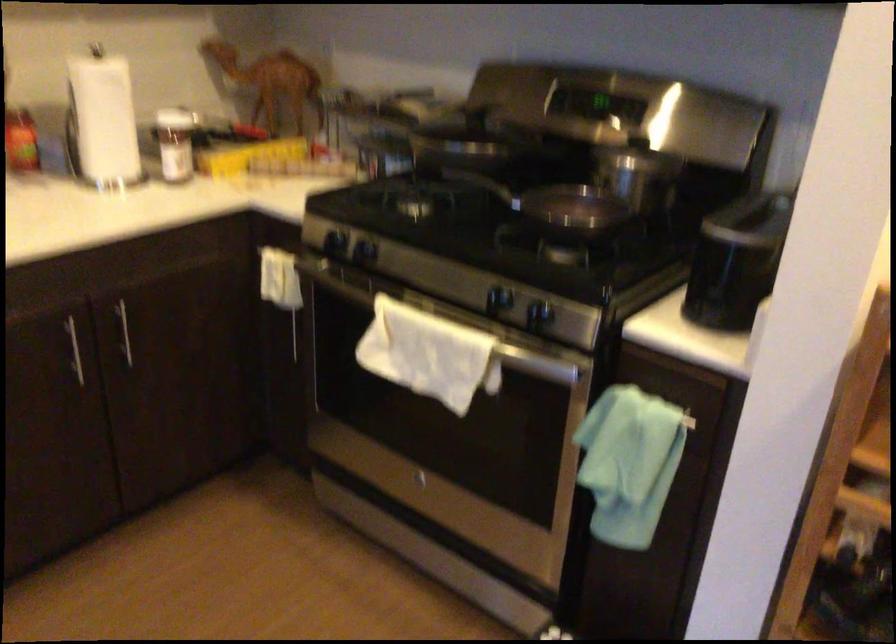
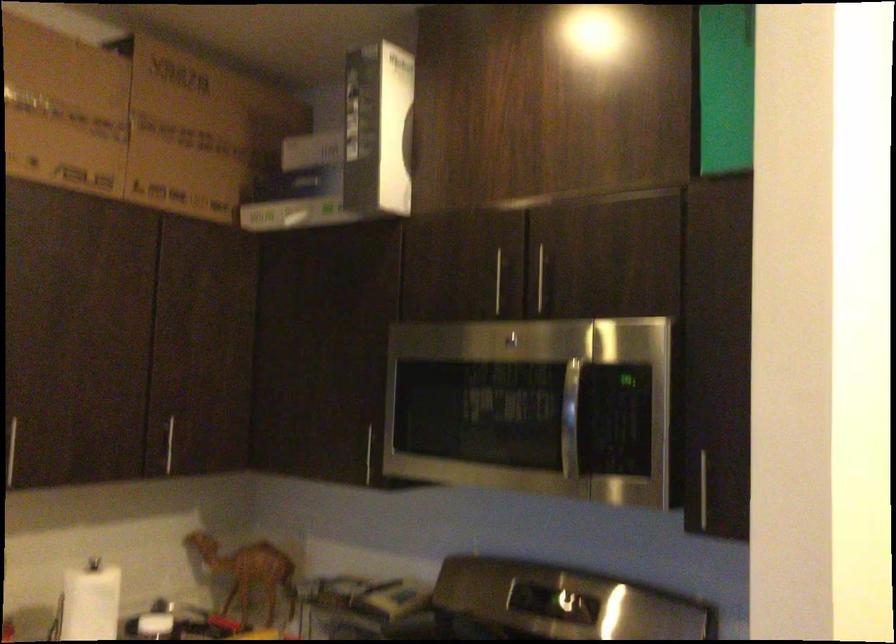
Question: Which direction would the cameraman need to move to produce the second image? Reply with the corresponding letter.

Choices:
 (A) Left
 (B) Right
 (C) Forward
 (D) Backward

Answer: (D)